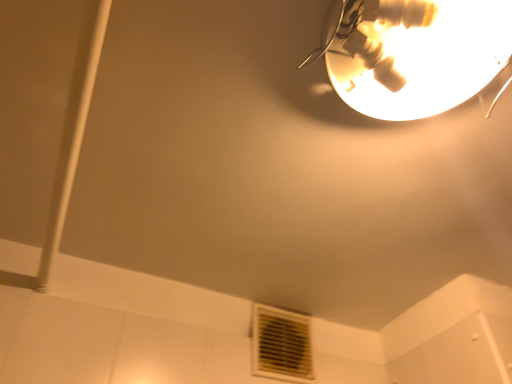
At what (x,y) coordinates should I click in order to perform the action: click on white plastic air conditioning at lower center. Please return your answer as a coordinate pair (x, y). Image resolution: width=512 pixels, height=384 pixels. Looking at the image, I should click on (281, 344).

In order to face white plastic air conditioning at lower center, should I rotate leftwards or rightwards?

Rotate right and turn 3.611 degrees.

What do you see at coordinates (281, 344) in the screenshot?
I see `white plastic air conditioning at lower center` at bounding box center [281, 344].

The image size is (512, 384). In order to click on metallic gold lampshade at upper right in this screenshot , I will do `click(413, 53)`.

Measure the distance between metallic gold lampshade at upper right and camera.

They are 20.37 inches apart.

This screenshot has height=384, width=512. What do you see at coordinates (413, 53) in the screenshot? I see `metallic gold lampshade at upper right` at bounding box center [413, 53].

Locate an element on the screen. white plastic air conditioning at lower center is located at coordinates 281,344.

In the image, is metallic gold lampshade at upper right on the left side or the right side of white plastic air conditioning at lower center?

From the image, it's evident that metallic gold lampshade at upper right is to the right of white plastic air conditioning at lower center.

Considering their positions, is metallic gold lampshade at upper right located in front of or behind white plastic air conditioning at lower center?

Visually, metallic gold lampshade at upper right is located in front of white plastic air conditioning at lower center.

Is point (442, 42) behind point (305, 323)?

No, (442, 42) is closer to viewer.

From the image's perspective, who appears lower, metallic gold lampshade at upper right or white plastic air conditioning at lower center?

From the image's view, white plastic air conditioning at lower center is below.

From a real-world perspective, relative to white plastic air conditioning at lower center, is metallic gold lampshade at upper right vertically above or below?

From a real-world perspective, metallic gold lampshade at upper right is physically above white plastic air conditioning at lower center.

In terms of width, does metallic gold lampshade at upper right look wider or thinner when compared to white plastic air conditioning at lower center?

Clearly, metallic gold lampshade at upper right has more width compared to white plastic air conditioning at lower center.

Considering the relative sizes of metallic gold lampshade at upper right and white plastic air conditioning at lower center in the image provided, is metallic gold lampshade at upper right shorter than white plastic air conditioning at lower center?

Yes.

Considering the sizes of objects metallic gold lampshade at upper right and white plastic air conditioning at lower center in the image provided, who is smaller, metallic gold lampshade at upper right or white plastic air conditioning at lower center?

Smaller between the two is white plastic air conditioning at lower center.

Is metallic gold lampshade at upper right completely or partially outside of white plastic air conditioning at lower center?

That's correct, metallic gold lampshade at upper right is outside of white plastic air conditioning at lower center.

Is metallic gold lampshade at upper right positioned far away from white plastic air conditioning at lower center?

That's not correct — metallic gold lampshade at upper right is a little close to white plastic air conditioning at lower center.

Could you tell me if metallic gold lampshade at upper right is turned towards white plastic air conditioning at lower center?

No, metallic gold lampshade at upper right is not turned towards white plastic air conditioning at lower center.

Can you tell me how much metallic gold lampshade at upper right and white plastic air conditioning at lower center differ in facing direction?

The angular difference between metallic gold lampshade at upper right and white plastic air conditioning at lower center is 5.08 degrees.

You are a GUI agent. You are given a task and a screenshot of the screen. Output one action in this format:
    pyautogui.click(x=<x>, y=<y>)
    Task: Click on the lamp lying on the right of white plastic air conditioning at lower center
    This screenshot has height=384, width=512.
    Given the screenshot: What is the action you would take?
    pyautogui.click(x=413, y=53)

Is white plastic air conditioning at lower center to the left of metallic gold lampshade at upper right from the viewer's perspective?

Correct, you'll find white plastic air conditioning at lower center to the left of metallic gold lampshade at upper right.

Considering the positions of objects white plastic air conditioning at lower center and metallic gold lampshade at upper right in the image provided, who is in front, white plastic air conditioning at lower center or metallic gold lampshade at upper right?

metallic gold lampshade at upper right.

Which point is more distant from viewer, (x=297, y=331) or (x=412, y=66)?

Positioned behind is point (x=297, y=331).

From the image's perspective, relative to metallic gold lampshade at upper right, is white plastic air conditioning at lower center above or below?

Clearly, from the image's perspective, white plastic air conditioning at lower center is below metallic gold lampshade at upper right.

From a real-world perspective, is white plastic air conditioning at lower center above or below metallic gold lampshade at upper right?

In terms of real-world spatial position, white plastic air conditioning at lower center is below metallic gold lampshade at upper right.

Does white plastic air conditioning at lower center have a lesser width compared to metallic gold lampshade at upper right?

Indeed, white plastic air conditioning at lower center has a lesser width compared to metallic gold lampshade at upper right.

Considering the sizes of white plastic air conditioning at lower center and metallic gold lampshade at upper right in the image, is white plastic air conditioning at lower center taller or shorter than metallic gold lampshade at upper right?

In the image, white plastic air conditioning at lower center appears to be taller than metallic gold lampshade at upper right.

Which of these two, white plastic air conditioning at lower center or metallic gold lampshade at upper right, is bigger?

metallic gold lampshade at upper right.

Is white plastic air conditioning at lower center not inside metallic gold lampshade at upper right?

Yes, white plastic air conditioning at lower center is not within metallic gold lampshade at upper right.

Would you say white plastic air conditioning at lower center is a long distance from metallic gold lampshade at upper right?

white plastic air conditioning at lower center is near metallic gold lampshade at upper right, not far away.

Is white plastic air conditioning at lower center facing towards metallic gold lampshade at upper right?

Yes, white plastic air conditioning at lower center is oriented towards metallic gold lampshade at upper right.

Can you tell me how much white plastic air conditioning at lower center and metallic gold lampshade at upper right differ in facing direction?

They differ by 5.08 degrees in their facing directions.

Identify the location of air conditioning below the metallic gold lampshade at upper right (from a real-world perspective). The height and width of the screenshot is (384, 512). (281, 344).

The image size is (512, 384). Identify the location of air conditioning on the left of metallic gold lampshade at upper right. (281, 344).

This screenshot has height=384, width=512. In the image, there is a metallic gold lampshade at upper right. Find the location of `air conditioning below it (from a real-world perspective)`. air conditioning below it (from a real-world perspective) is located at coordinates (281, 344).